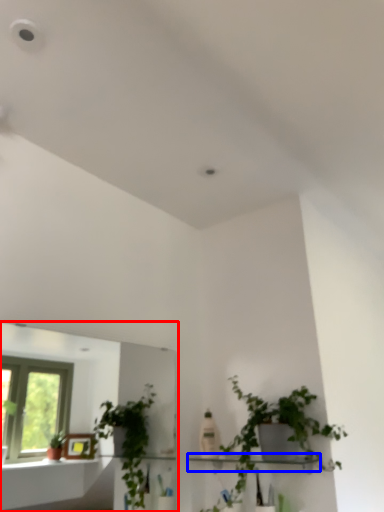
Question: Which of the following is the closest to the observer, mirror (highlighted by a red box) or shelf (highlighted by a blue box)?

Choices:
 (A) mirror
 (B) shelf

Answer: (A)